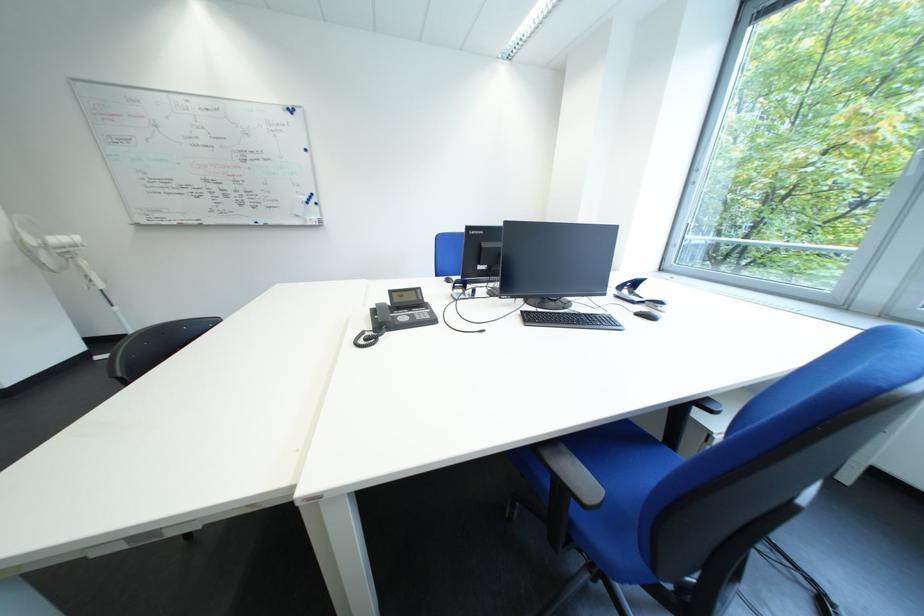
At what (x,y) coordinates should I click in order to perform the action: click on blue chair armrest. Please return your answer as a coordinate pair (x, y). The height and width of the screenshot is (616, 924). Looking at the image, I should click on (577, 482).